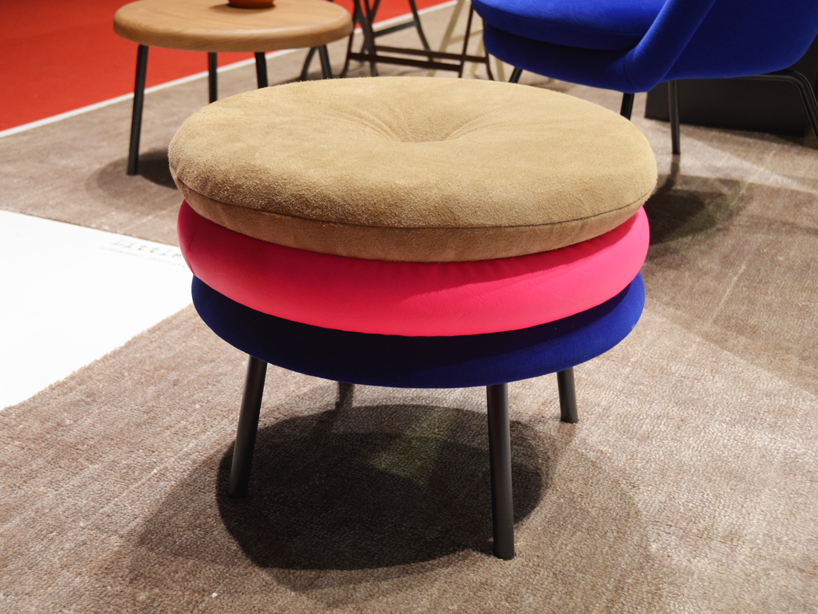
Locate an element on the screen. This screenshot has width=818, height=614. stool leg is located at coordinates (345, 393).